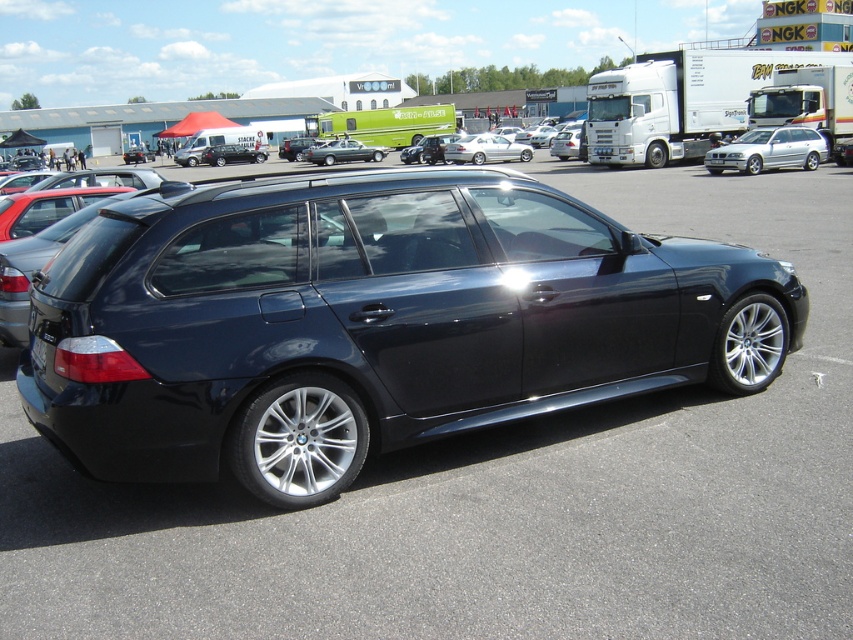
You are standing in front of the dark BMW station wagon at the car exhibition. You notice two points marked on the car, one at coordinates point (379, 154) and the other at point (45, 360). Which of these points is closer to your viewpoint?

Point (45, 360) is closer to your viewpoint because it is less further to the camera than point (379, 154).

You need to park your car behind the silver metallic wagon at right so that it doesn not block the license plate. Can you fit your car without overlapping the black plastic license plate at rear?

The silver metallic wagon at right is wider than the black plastic license plate at rear, so yes, you can park your car behind the silver metallic wagon at right without overlapping the black plastic license plate at rear since its width is larger.